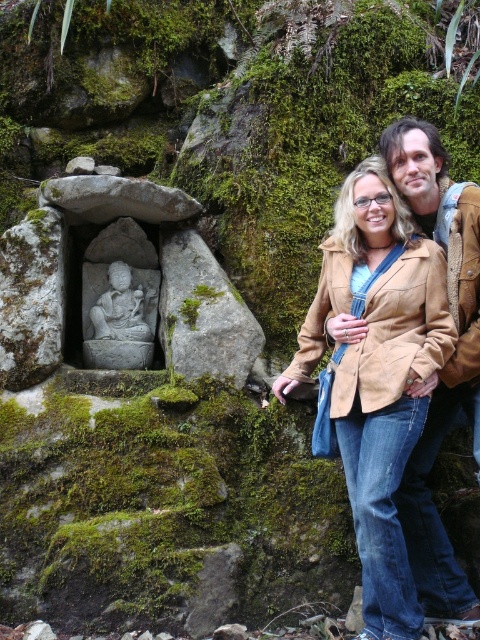
Question: Is matte brown leather jacket at center to the right of brown leather jacket at right from the viewer's perspective?

Choices:
 (A) no
 (B) yes

Answer: (A)

Question: Among these objects, which one is nearest to the camera?

Choices:
 (A) brown leather jacket at right
 (B) white stone statue at left

Answer: (A)

Question: Which of these objects is positioned farthest from the matte brown leather jacket at center?

Choices:
 (A) brown leather jacket at right
 (B) white stone statue at left

Answer: (B)

Question: Can you confirm if matte brown leather jacket at center is positioned above white stone statue at left?

Choices:
 (A) yes
 (B) no

Answer: (B)

Question: Among these objects, which one is farthest from the camera?

Choices:
 (A) brown leather jacket at right
 (B) white stone statue at left
 (C) matte brown leather jacket at center

Answer: (B)

Question: Does matte brown leather jacket at center have a smaller size compared to white stone statue at left?

Choices:
 (A) no
 (B) yes

Answer: (A)